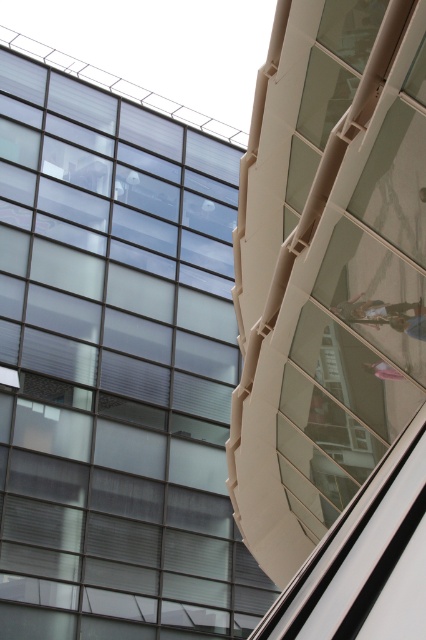
Question: Is transparent glass window at upper left closer to camera compared to metallic silver person at center?

Choices:
 (A) no
 (B) yes

Answer: (A)

Question: Among these points, which one is nearest to the camera?

Choices:
 (A) (65, 337)
 (B) (400, 316)

Answer: (B)

Question: Does transparent glass window at upper left have a lesser width compared to metallic silver person at center?

Choices:
 (A) yes
 (B) no

Answer: (B)

Question: Is transparent glass window at upper left above metallic silver person at center?

Choices:
 (A) yes
 (B) no

Answer: (B)

Question: Which point appears closest to the camera in this image?

Choices:
 (A) (368, 310)
 (B) (259, 566)

Answer: (A)

Question: Which of the following is the closest to the observer?

Choices:
 (A) transparent glass window at upper left
 (B) metallic silver person at center

Answer: (B)